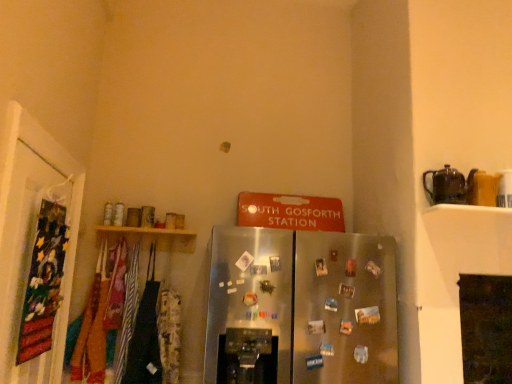
Question: Would you say satin silver refrigerator at center is to the left or to the right of brown ceramic teapot at upper right in the picture?

Choices:
 (A) right
 (B) left

Answer: (B)

Question: Looking at their shapes, would you say satin silver refrigerator at center is wider or thinner than brown ceramic teapot at upper right?

Choices:
 (A) thin
 (B) wide

Answer: (B)

Question: Which object is positioned farthest from the satin silver refrigerator at center?

Choices:
 (A) wooden shelf at upper left
 (B) brown ceramic teapot at upper right
 (C) velvet fabric banner at left

Answer: (C)

Question: Which object is positioned closest to the brown ceramic teapot at upper right?

Choices:
 (A) satin silver refrigerator at center
 (B) velvet fabric banner at left
 (C) wooden shelf at upper left

Answer: (A)